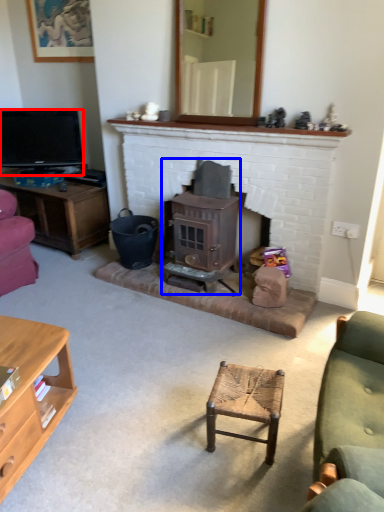
Question: Which point is closer to the camera, television (highlighted by a red box) or wood burning stove (highlighted by a blue box)?

Choices:
 (A) television
 (B) wood burning stove

Answer: (B)